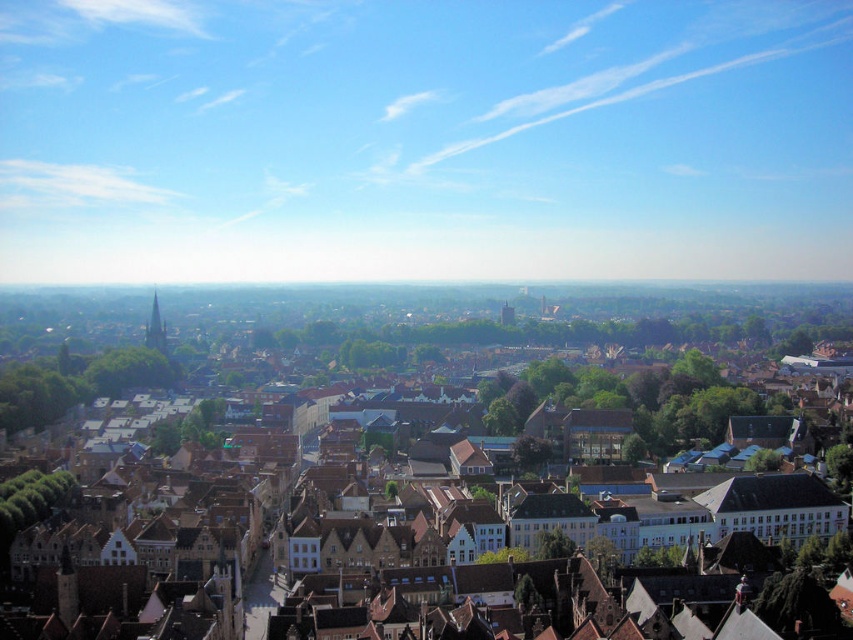
Is brown brick buildings at center bigger than green stone tower at left?

Yes.

I want to click on brown brick buildings at center, so click(531, 467).